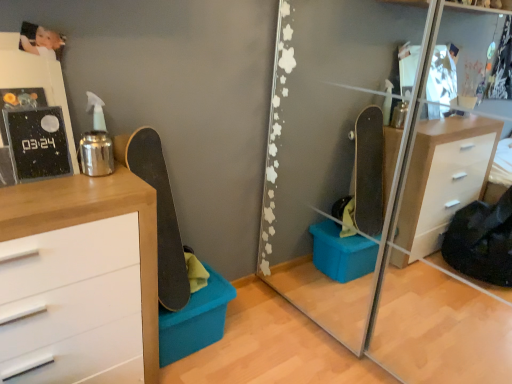
Question: From the image's perspective, is transparent glass mirror at center beneath matte blue plastic storage box at lower center?

Choices:
 (A) yes
 (B) no

Answer: (B)

Question: Considering the relative sizes of transparent glass mirror at center and matte blue plastic storage box at lower center in the image provided, is transparent glass mirror at center bigger than matte blue plastic storage box at lower center?

Choices:
 (A) no
 (B) yes

Answer: (B)

Question: Does transparent glass mirror at center have a smaller size compared to matte blue plastic storage box at lower center?

Choices:
 (A) no
 (B) yes

Answer: (A)

Question: Is transparent glass mirror at center facing towards matte blue plastic storage box at lower center?

Choices:
 (A) yes
 (B) no

Answer: (A)

Question: Does transparent glass mirror at center lie in front of matte blue plastic storage box at lower center?

Choices:
 (A) yes
 (B) no

Answer: (A)

Question: Can you confirm if transparent glass mirror at center is wider than matte blue plastic storage box at lower center?

Choices:
 (A) yes
 (B) no

Answer: (A)

Question: Does smooth black skateboard at left contain transparent glass mirror at center?

Choices:
 (A) no
 (B) yes

Answer: (A)

Question: Can you confirm if smooth black skateboard at left is taller than transparent glass mirror at center?

Choices:
 (A) no
 (B) yes

Answer: (A)

Question: Is smooth black skateboard at left positioned with its back to transparent glass mirror at center?

Choices:
 (A) yes
 (B) no

Answer: (B)

Question: Considering the relative positions of smooth black skateboard at left and transparent glass mirror at center in the image provided, is smooth black skateboard at left to the left of transparent glass mirror at center from the viewer's perspective?

Choices:
 (A) yes
 (B) no

Answer: (A)

Question: Is smooth black skateboard at left oriented towards transparent glass mirror at center?

Choices:
 (A) yes
 (B) no

Answer: (B)

Question: Does smooth black skateboard at left have a larger size compared to transparent glass mirror at center?

Choices:
 (A) yes
 (B) no

Answer: (B)

Question: Does smooth black skateboard at left have a lesser height compared to matte blue plastic storage box at lower center?

Choices:
 (A) yes
 (B) no

Answer: (B)